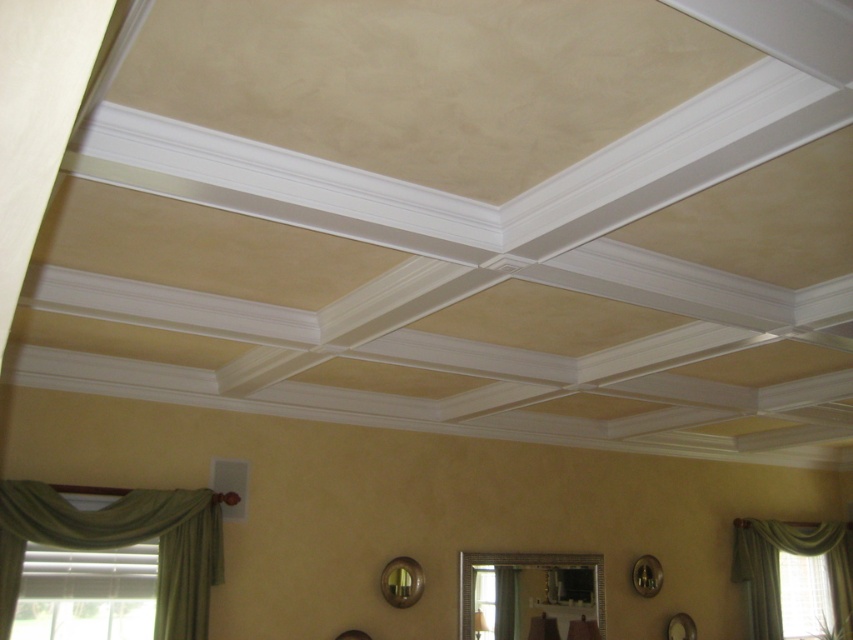
Which is more to the left, green fabric curtain at lower left or green fabric curtain at lower right?

Positioned to the left is green fabric curtain at lower left.

Does green fabric curtain at lower left have a lesser height compared to green fabric curtain at lower right?

Correct, green fabric curtain at lower left is not as tall as green fabric curtain at lower right.

Does point (216, 564) come closer to viewer compared to point (815, 548)?

Yes, point (216, 564) is in front of point (815, 548).

This screenshot has width=853, height=640. In order to click on green fabric curtain at lower left in this screenshot , I will do `click(120, 545)`.